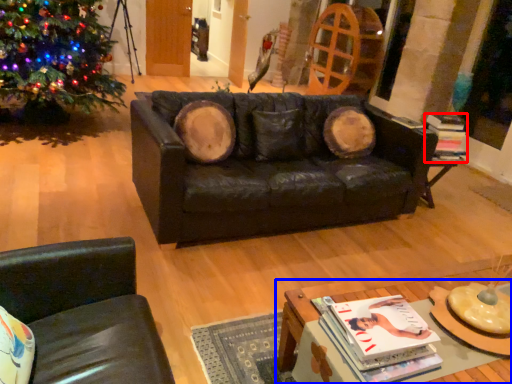
Question: Which of the following is the closest to the observer, magazine (highlighted by a red box) or table (highlighted by a blue box)?

Choices:
 (A) magazine
 (B) table

Answer: (B)